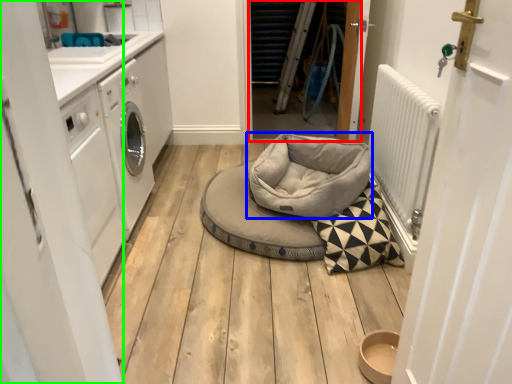
Question: Estimate the real-world distances between objects in this image. Which object is farther from door (highlighted by a red box), dog bed (highlighted by a blue box) or door (highlighted by a green box)?

Choices:
 (A) dog bed
 (B) door

Answer: (B)